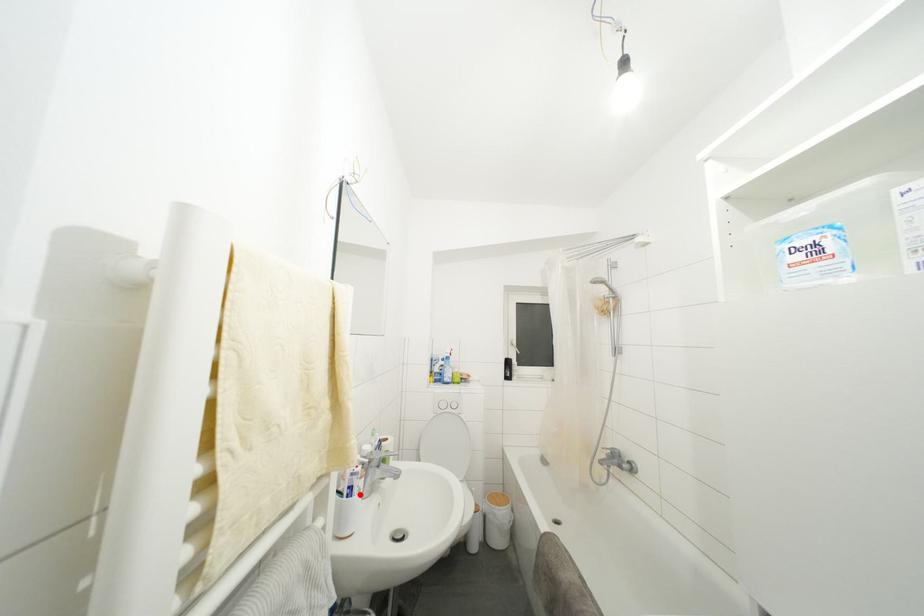
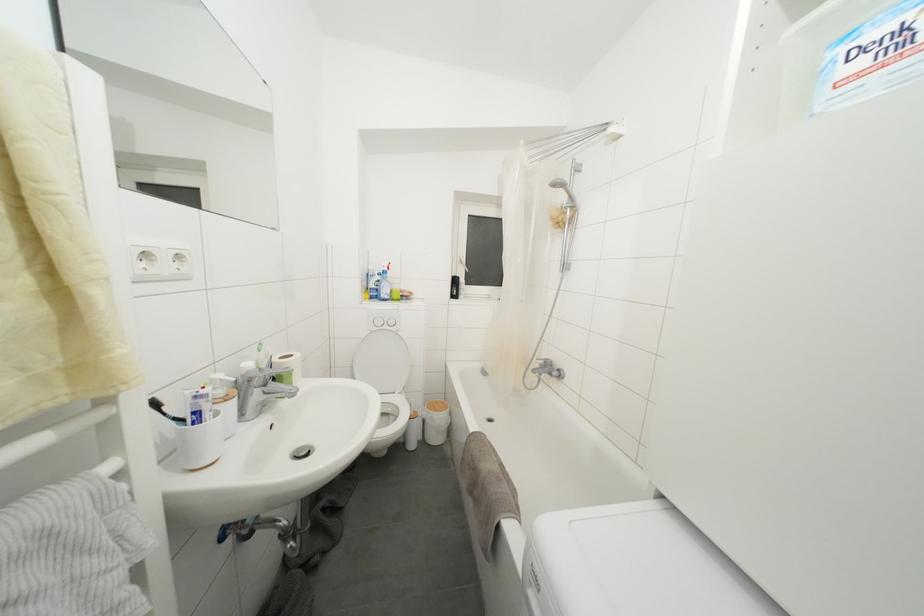
In the second image, find the point that corresponds to the highlighted location in the first image.

(211, 419)